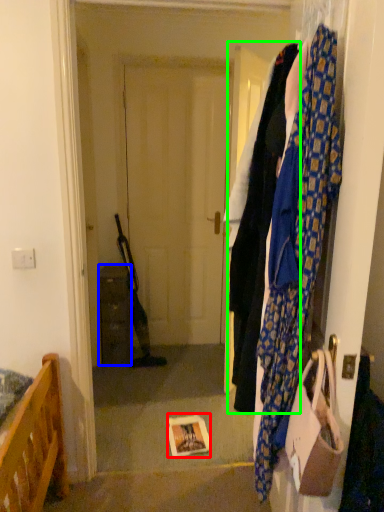
Question: Which is farther away from book (highlighted by a red box)? cabinetry (highlighted by a blue box) or clothing (highlighted by a green box)?

Choices:
 (A) cabinetry
 (B) clothing

Answer: (A)